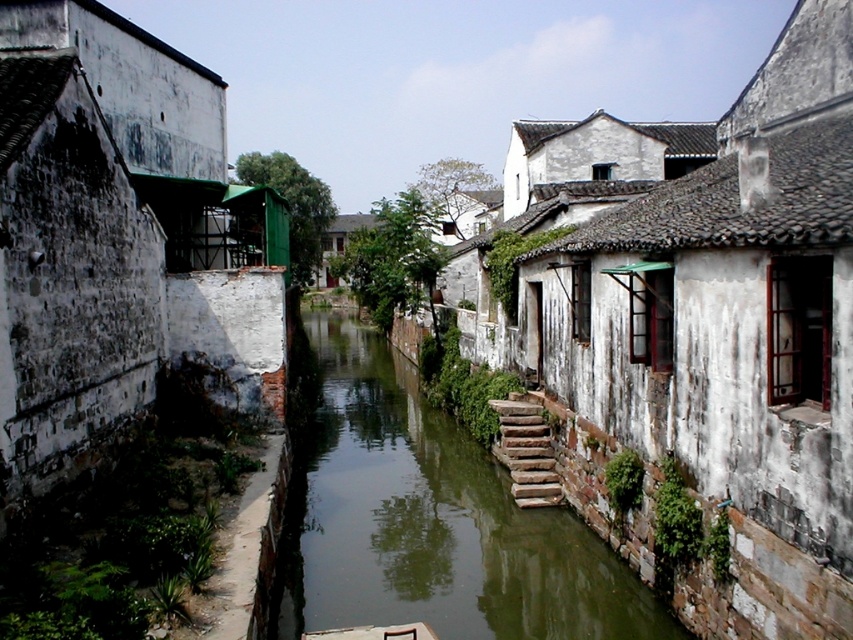
Question: In this image, where is green mossy stone at center located relative to stone steps at center?

Choices:
 (A) above
 (B) below

Answer: (B)

Question: Which object appears closest to the camera in this image?

Choices:
 (A) green mossy stone at center
 (B) stone steps at center

Answer: (A)

Question: Which point is farther to the camera?

Choices:
 (A) (618, 628)
 (B) (537, 451)

Answer: (B)

Question: Is green mossy stone at center to the right of stone steps at center from the viewer's perspective?

Choices:
 (A) no
 (B) yes

Answer: (A)

Question: Is green mossy stone at center positioned before stone steps at center?

Choices:
 (A) yes
 (B) no

Answer: (A)

Question: Among these objects, which one is farthest from the camera?

Choices:
 (A) green mossy stone at center
 (B) stone steps at center

Answer: (B)